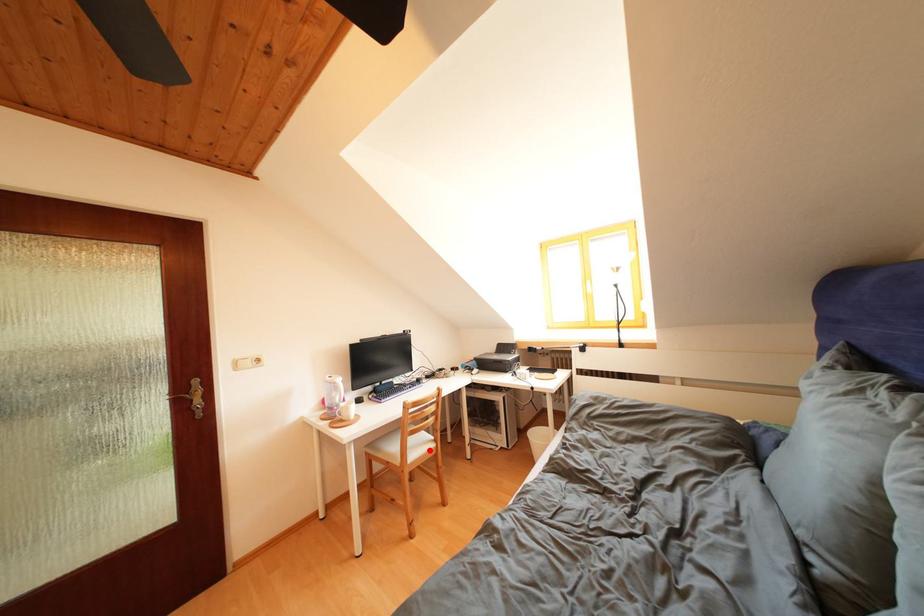
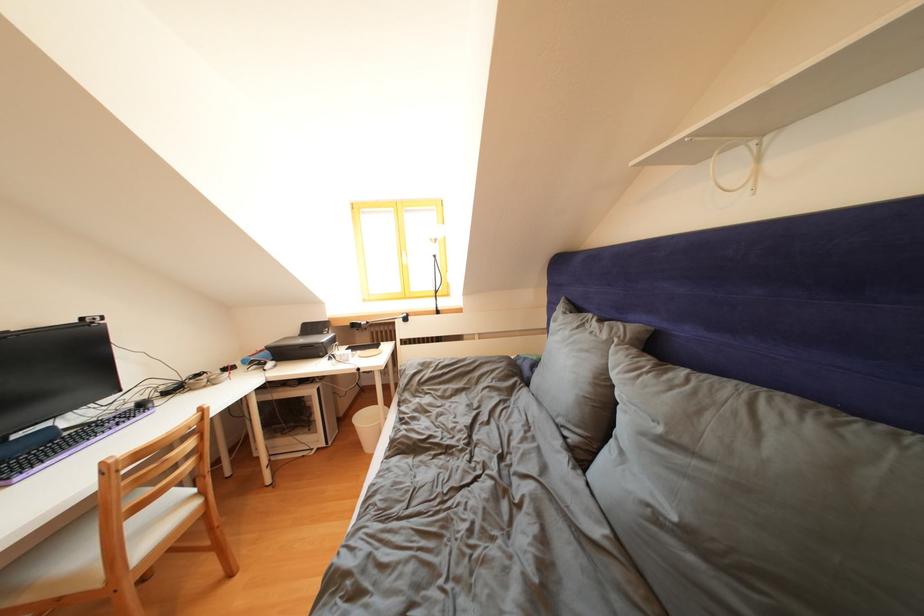
Question: I am providing you with two images of the same scene from different viewpoints. In image1, a red point is highlighted. Considering the same 3D point in image2, which of the following is correct?

Choices:
 (A) It is closer
 (B) It is farther

Answer: (A)